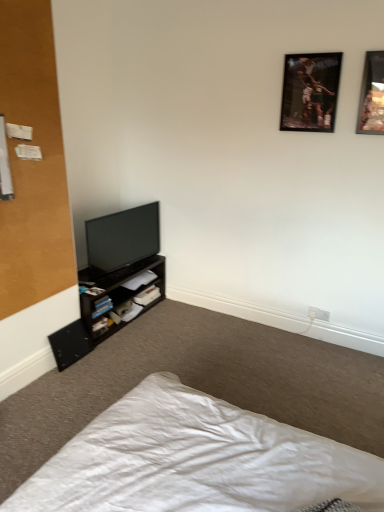
What do you see at coordinates (70, 344) in the screenshot? The width and height of the screenshot is (384, 512). I see `black matte speaker at lower left` at bounding box center [70, 344].

Identify the location of matte black tv at lower left. The height and width of the screenshot is (512, 384). click(x=123, y=237).

What is the approximate height of wooden-framed picture at upper right, the 2th picture frame in the right-to-left sequence?

It is 45.05 centimeters.

Describe the element at coordinates (101, 325) in the screenshot. The height and width of the screenshot is (512, 384). I see `hardcover book at lower left, which appears as the third book when viewed from the top` at that location.

What is the approximate height of white plastic electric outlet at lower right?

The height of white plastic electric outlet at lower right is 3.29 inches.

Describe the element at coordinates (196, 460) in the screenshot. I see `white fabric bed at lower left` at that location.

Locate an element on the screen. The height and width of the screenshot is (512, 384). white paper at lower center, which ranks as the 2th book in top-to-bottom order is located at coordinates (147, 295).

I want to click on the 1st book counting from the left side of the wooden picture frame at upper right, acting as the 2th picture frame starting from the left, so pyautogui.click(x=147, y=295).

Is wooden picture frame at upper right, marked as the first picture frame in a right-to-left arrangement, thinner than white paper at lower center, the second book in the bottom-to-top sequence?

Yes.

Can you tell me how much wooden picture frame at upper right, acting as the 2th picture frame starting from the left, and white paper at lower center, which ranks as the 2th book in top-to-bottom order, differ in facing direction?

88.5 degrees.

Are wooden picture frame at upper right, acting as the 2th picture frame starting from the left, and white paper at lower center, the second book in the bottom-to-top sequence, located far from each other?

wooden picture frame at upper right, acting as the 2th picture frame starting from the left, is far away from white paper at lower center, the second book in the bottom-to-top sequence.

Which of these two, white fabric bed at lower left or hardcover book at lower left, which appears as the third book when viewed from the top, is bigger?

With larger size is white fabric bed at lower left.

Considering the positions of objects white fabric bed at lower left and hardcover book at lower left, the 1th book positioned from the bottom, in the image provided, who is behind, white fabric bed at lower left or hardcover book at lower left, the 1th book positioned from the bottom,?

hardcover book at lower left, the 1th book positioned from the bottom, is behind.

Can you confirm if white fabric bed at lower left is positioned to the left of hardcover book at lower left, the 1th book positioned from the bottom?

No.

Is white fabric bed at lower left completely or partially outside of hardcover book at lower left, the 1th book positioned from the bottom?

Yes, white fabric bed at lower left is outside of hardcover book at lower left, the 1th book positioned from the bottom.

Are white fabric bed at lower left and white matte book at lower left, acting as the third book starting from the bottom, beside each other?

white fabric bed at lower left and white matte book at lower left, acting as the third book starting from the bottom, are not in contact.

From a real-world perspective, between white fabric bed at lower left and white matte book at lower left, acting as the third book starting from the bottom, who is vertically higher?

white matte book at lower left, acting as the third book starting from the bottom, from a real-world perspective.

From the picture: Which of these two, white fabric bed at lower left or white matte book at lower left, acting as the third book starting from the bottom, is bigger?

white fabric bed at lower left is bigger.

Considering the sizes of white fabric bed at lower left and white matte book at lower left, which appears as the 1th book when viewed from the top, in the image, is white fabric bed at lower left taller or shorter than white matte book at lower left, which appears as the 1th book when viewed from the top,?

In the image, white fabric bed at lower left appears to be shorter than white matte book at lower left, which appears as the 1th book when viewed from the top.

Which of these two, white plastic electric outlet at lower right or hardcover book at lower left, which appears as the third book when viewed from the top, stands taller?

hardcover book at lower left, which appears as the third book when viewed from the top, is taller.

Is white plastic electric outlet at lower right positioned behind hardcover book at lower left, the 1th book positioned from the bottom?

No, the depth of white plastic electric outlet at lower right is less than that of hardcover book at lower left, the 1th book positioned from the bottom.

Which point is more forward, (x=324, y=313) or (x=101, y=329)?

The point (x=101, y=329) is in front.

Considering the positions of objects white plastic electric outlet at lower right and hardcover book at lower left, the 1th book positioned from the bottom, in the image provided, who is more to the right, white plastic electric outlet at lower right or hardcover book at lower left, the 1th book positioned from the bottom,?

Positioned to the right is white plastic electric outlet at lower right.

Is wooden picture frame at upper right, marked as the first picture frame in a right-to-left arrangement, in front of or behind white plastic electric outlet at lower right in the image?

wooden picture frame at upper right, marked as the first picture frame in a right-to-left arrangement, is positioned closer to the viewer than white plastic electric outlet at lower right.

Considering the sizes of objects wooden picture frame at upper right, marked as the first picture frame in a right-to-left arrangement, and white plastic electric outlet at lower right in the image provided, who is wider, wooden picture frame at upper right, marked as the first picture frame in a right-to-left arrangement, or white plastic electric outlet at lower right?

With larger width is wooden picture frame at upper right, marked as the first picture frame in a right-to-left arrangement.

Are wooden picture frame at upper right, acting as the 2th picture frame starting from the left, and white plastic electric outlet at lower right located far from each other?

Absolutely, wooden picture frame at upper right, acting as the 2th picture frame starting from the left, is distant from white plastic electric outlet at lower right.

Does wooden picture frame at upper right, marked as the first picture frame in a right-to-left arrangement, turn towards white plastic electric outlet at lower right?

No, wooden picture frame at upper right, marked as the first picture frame in a right-to-left arrangement, does not turn towards white plastic electric outlet at lower right.

Consider the image. Is black matte speaker at lower left at the right side of white plastic electric outlet at lower right?

No, black matte speaker at lower left is not to the right of white plastic electric outlet at lower right.

How different are the orientations of black matte speaker at lower left and white plastic electric outlet at lower right in degrees?

There is a 90.4-degree angle between the facing directions of black matte speaker at lower left and white plastic electric outlet at lower right.

You are a GUI agent. You are given a task and a screenshot of the screen. Output one action in this format:
    pyautogui.click(x=<x>, y=<y>)
    Task: Click on the speaker directly beneath the white plastic electric outlet at lower right (from a real-world perspective)
    
    Given the screenshot: What is the action you would take?
    pyautogui.click(x=70, y=344)

Which is more to the right, dark brown wooden shelf at lower left or black matte speaker at lower left?

dark brown wooden shelf at lower left is more to the right.

Is dark brown wooden shelf at lower left taller than black matte speaker at lower left?

Yes, dark brown wooden shelf at lower left is taller than black matte speaker at lower left.

How many degrees apart are the facing directions of dark brown wooden shelf at lower left and black matte speaker at lower left?

The facing directions of dark brown wooden shelf at lower left and black matte speaker at lower left are 0.905 degrees apart.

Is dark brown wooden shelf at lower left inside the boundaries of black matte speaker at lower left, or outside?

dark brown wooden shelf at lower left is located beyond the bounds of black matte speaker at lower left.

From the wooden picture frame at upper right, marked as the first picture frame in a right-to-left arrangement, count 3rd books backward and point to it. Please provide its 2D coordinates.

[(147, 295)]

The image size is (384, 512). Identify the location of bed below the hardcover book at lower left, the 1th book positioned from the bottom (from a real-world perspective). (196, 460).

Looking at the image, which one is located closer to white fabric bed at lower left, white paper at lower center, the second book in the bottom-to-top sequence, or black matte speaker at lower left?

Based on the image, black matte speaker at lower left appears to be nearer to white fabric bed at lower left.

From the picture: Considering their positions, is white matte book at lower left, acting as the third book starting from the bottom, positioned closer to white plastic electric outlet at lower right than white fabric bed at lower left?

white matte book at lower left, acting as the third book starting from the bottom, is closer to white plastic electric outlet at lower right.

Estimate the real-world distances between objects in this image. Which object is further from white plastic electric outlet at lower right, wooden picture frame at upper right, acting as the 2th picture frame starting from the left, or white fabric bed at lower left?

white fabric bed at lower left is positioned further to the anchor white plastic electric outlet at lower right.

Based on the photo, based on their spatial positions, is hardcover book at lower left, which appears as the third book when viewed from the top, or wooden picture frame at upper right, marked as the first picture frame in a right-to-left arrangement, further from white paper at lower center, which ranks as the 2th book in top-to-bottom order?

Among the two, wooden picture frame at upper right, marked as the first picture frame in a right-to-left arrangement, is located further to white paper at lower center, which ranks as the 2th book in top-to-bottom order.

Considering their positions, is matte black tv at lower left positioned closer to wooden picture frame at upper right, marked as the first picture frame in a right-to-left arrangement, than black matte speaker at lower left?

Among the two, matte black tv at lower left is located nearer to wooden picture frame at upper right, marked as the first picture frame in a right-to-left arrangement.

Based on their spatial positions, is matte black tv at lower left or wooden picture frame at upper right, acting as the 2th picture frame starting from the left, closer to white matte book at lower left, which appears as the 1th book when viewed from the top?

matte black tv at lower left is positioned closer to the anchor white matte book at lower left, which appears as the 1th book when viewed from the top.

Considering their positions, is wooden-framed picture at upper right, the first picture frame in the left-to-right sequence, positioned further to matte black tv at lower left than white paper at lower center, which ranks as the 2th book in top-to-bottom order?

wooden-framed picture at upper right, the first picture frame in the left-to-right sequence, is positioned further to the anchor matte black tv at lower left.

Estimate the real-world distances between objects in this image. Which object is closer to hardcover book at lower left, which appears as the third book when viewed from the top, white paper at lower center, the second book in the bottom-to-top sequence, or white fabric bed at lower left?

white paper at lower center, the second book in the bottom-to-top sequence.

Find the location of a particular element. picture frame between hardcover book at lower left, which appears as the third book when viewed from the top, and wooden picture frame at upper right, acting as the 2th picture frame starting from the left is located at coordinates (310, 92).

The image size is (384, 512). Identify the location of electric outlet between white fabric bed at lower left and hardcover book at lower left, the 1th book positioned from the bottom, in the front-back direction. (318, 314).

This screenshot has width=384, height=512. Identify the location of speaker between white fabric bed at lower left and white paper at lower center, which ranks as the 2th book in top-to-bottom order, along the z-axis. (70, 344).

Identify the location of picture frame located between hardcover book at lower left, the 1th book positioned from the bottom, and white plastic electric outlet at lower right in the left-right direction. (310, 92).